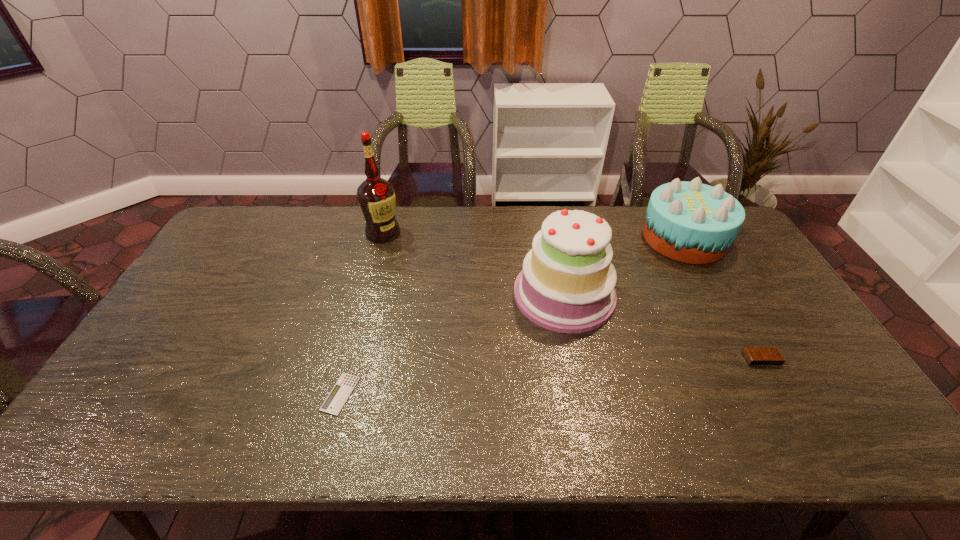
You are a GUI agent. You are given a task and a screenshot of the screen. Output one action in this format:
    pyautogui.click(x=<x>, y=<y>)
    Task: Click on the vacant space at the far edge
    The height and width of the screenshot is (540, 960).
    Given the screenshot: What is the action you would take?
    pyautogui.click(x=645, y=207)

Image resolution: width=960 pixels, height=540 pixels. I want to click on vacant point at the near edge, so click(x=473, y=430).

Image resolution: width=960 pixels, height=540 pixels. What are the coordinates of `free point at the left edge` in the screenshot? It's located at (197, 327).

At what (x,y) coordinates should I click in order to perform the action: click on free space at the right edge of the desktop. Please return your answer as a coordinate pair (x, y). Looking at the image, I should click on (749, 247).

The height and width of the screenshot is (540, 960). In the image, there is a desktop. Find the location of `free space at the far left corner`. free space at the far left corner is located at coordinates 276,215.

Where is `free space between the calculator and the tallest object`? Image resolution: width=960 pixels, height=540 pixels. free space between the calculator and the tallest object is located at coordinates (362, 313).

Locate an element on the screen. This screenshot has height=540, width=960. free space between the left cake and the shorter cake is located at coordinates (624, 266).

The width and height of the screenshot is (960, 540). I want to click on vacant space that's between the third object from right to left and the alarm clock, so click(662, 327).

Where is `empty location between the shorter cake and the third object from right to left`? The height and width of the screenshot is (540, 960). empty location between the shorter cake and the third object from right to left is located at coordinates (624, 266).

Image resolution: width=960 pixels, height=540 pixels. I want to click on empty space between the left cake and the shortest object, so click(452, 344).